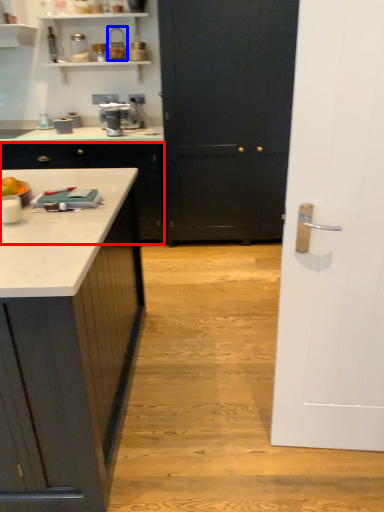
Question: Which point is closer to the camera, cabinetry (highlighted by a red box) or appliance (highlighted by a blue box)?

Choices:
 (A) cabinetry
 (B) appliance

Answer: (A)